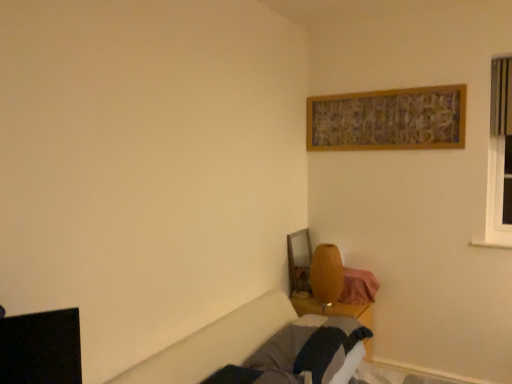
Question: Does wooden bed frame at lower right have a lesser width compared to matte yellow vase at lower center?

Choices:
 (A) no
 (B) yes

Answer: (A)

Question: Considering the relative positions of wooden bed frame at lower right and matte yellow vase at lower center in the image provided, is wooden bed frame at lower right to the right of matte yellow vase at lower center from the viewer's perspective?

Choices:
 (A) no
 (B) yes

Answer: (A)

Question: Can we say wooden bed frame at lower right lies outside matte yellow vase at lower center?

Choices:
 (A) yes
 (B) no

Answer: (A)

Question: Can you confirm if wooden bed frame at lower right is bigger than matte yellow vase at lower center?

Choices:
 (A) no
 (B) yes

Answer: (B)

Question: From the image's perspective, is wooden bed frame at lower right over matte yellow vase at lower center?

Choices:
 (A) yes
 (B) no

Answer: (B)

Question: Is wooden bed frame at lower right touching matte yellow vase at lower center?

Choices:
 (A) no
 (B) yes

Answer: (A)

Question: Is matte yellow vase at lower center facing towards wooden bed frame at lower right?

Choices:
 (A) yes
 (B) no

Answer: (B)

Question: From a real-world perspective, is matte yellow vase at lower center on wooden bed frame at lower right?

Choices:
 (A) yes
 (B) no

Answer: (A)

Question: From a real-world perspective, is matte yellow vase at lower center beneath wooden bed frame at lower right?

Choices:
 (A) yes
 (B) no

Answer: (B)

Question: Considering the relative sizes of matte yellow vase at lower center and wooden bed frame at lower right in the image provided, is matte yellow vase at lower center shorter than wooden bed frame at lower right?

Choices:
 (A) yes
 (B) no

Answer: (B)

Question: Considering the relative positions of matte yellow vase at lower center and wooden bed frame at lower right in the image provided, is matte yellow vase at lower center behind wooden bed frame at lower right?

Choices:
 (A) no
 (B) yes

Answer: (B)

Question: Can you confirm if matte yellow vase at lower center is positioned to the left of wooden bed frame at lower right?

Choices:
 (A) no
 (B) yes

Answer: (A)

Question: From the image's perspective, relative to wooden bed frame at lower right, is matte yellow vase at lower center above or below?

Choices:
 (A) above
 (B) below

Answer: (A)